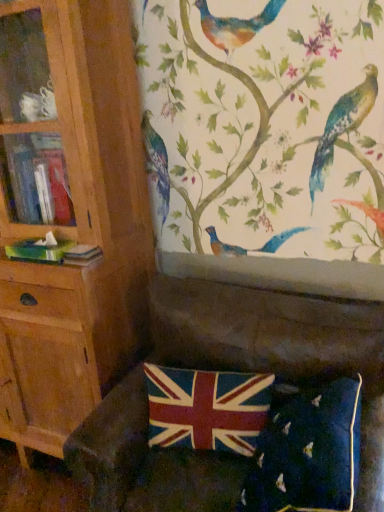
Find the location of a particular element. This screenshot has width=384, height=512. velvet union jack pillow at lower center is located at coordinates (308, 453).

The image size is (384, 512). What do you see at coordinates (278, 346) in the screenshot?
I see `velvet dark green couch at lower center` at bounding box center [278, 346].

Describe the element at coordinates (69, 215) in the screenshot. Image resolution: width=384 pixels, height=512 pixels. I see `wooden bookcase at left` at that location.

You are a GUI agent. You are given a task and a screenshot of the screen. Output one action in this format:
    pyautogui.click(x=<x>, y=<y>)
    Task: Click on the velvet union jack pillow at lower center
    The width and height of the screenshot is (384, 512).
    Given the screenshot: What is the action you would take?
    pyautogui.click(x=308, y=453)

Does point (245, 430) appear closer or farther from the camera than point (314, 298)?

Point (245, 430) is positioned closer to the camera compared to point (314, 298).

From the image's perspective, which is above, velvet union jack at lower center or velvet dark green couch at lower center?

velvet union jack at lower center is shown above in the image.

Consider the image. Is velvet dark green couch at lower center a part of velvet union jack at lower center?

Definitely not — velvet dark green couch at lower center is not inside velvet union jack at lower center.

From a real-world perspective, which object rests below the other?

velvet dark green couch at lower center.

Find the location of `pillow above the velvet dark green couch at lower center (from the image's perspective)`. pillow above the velvet dark green couch at lower center (from the image's perspective) is located at coordinates (308, 453).

Could velvet union jack pillow at lower center be considered to be inside velvet dark green couch at lower center?

Indeed, velvet union jack pillow at lower center is located within velvet dark green couch at lower center.

Does point (352, 356) come in front of point (300, 451)?

No, it is behind (300, 451).

From a real-world perspective, does velvet union jack at lower center sit lower than velvet union jack pillow at lower center?

Incorrect, from a real-world perspective, velvet union jack at lower center is higher than velvet union jack pillow at lower center.

Is point (173, 430) positioned behind point (247, 497)?

That is True.

Is velvet union jack pillow at lower center inside velvet union jack at lower center?

Actually, velvet union jack pillow at lower center is outside velvet union jack at lower center.

Does velvet union jack at lower center have a larger size compared to wooden bookcase at left?

No.

Is point (236, 441) farther from viewer compared to point (0, 170)?

No, it is not.

Relative to wooden bookcase at left, is velvet union jack at lower center in front or behind?

In the image, velvet union jack at lower center appears behind wooden bookcase at left.

Would you consider velvet union jack at lower center to be distant from wooden bookcase at left?

Actually, velvet union jack at lower center and wooden bookcase at left are a little close together.

Is velvet union jack pillow at lower center not close to velvet dark green couch at lower center?

They are positioned close to each other.

Considering the sizes of objects velvet union jack pillow at lower center and velvet dark green couch at lower center in the image provided, who is smaller, velvet union jack pillow at lower center or velvet dark green couch at lower center?

With smaller size is velvet union jack pillow at lower center.

Can you confirm if velvet union jack pillow at lower center is thinner than velvet dark green couch at lower center?

Yes, velvet union jack pillow at lower center is thinner than velvet dark green couch at lower center.

From the image's perspective, between velvet union jack pillow at lower center and velvet dark green couch at lower center, which one is located above?

velvet union jack pillow at lower center is shown above in the image.

From the image's perspective, who appears lower, velvet dark green couch at lower center or wooden bookcase at left?

velvet dark green couch at lower center appears lower in the image.

Choose the correct answer: Is velvet dark green couch at lower center inside wooden bookcase at left or outside it?

velvet dark green couch at lower center lies outside wooden bookcase at left.

Which object is more forward, velvet dark green couch at lower center or wooden bookcase at left?

velvet dark green couch at lower center.

Is point (250, 352) behind point (97, 115)?

No, it is not.

From their relative heights in the image, would you say wooden bookcase at left is taller or shorter than velvet union jack at lower center?

Clearly, wooden bookcase at left is taller compared to velvet union jack at lower center.

In order to click on flag behind the wooden bookcase at left in this screenshot , I will do `click(207, 408)`.

From the image's perspective, which is above, wooden bookcase at left or velvet union jack at lower center?

wooden bookcase at left is shown above in the image.

Measure the distance from wooden bookcase at left to velvet union jack at lower center.

wooden bookcase at left and velvet union jack at lower center are 22.94 inches apart from each other.

The width and height of the screenshot is (384, 512). In order to click on studio couch on the right of velvet union jack at lower center in this screenshot , I will do `click(278, 346)`.

At what (x,y) coordinates should I click in order to perform the action: click on studio couch to the left of velvet union jack pillow at lower center. Please return your answer as a coordinate pair (x, y). This screenshot has width=384, height=512. Looking at the image, I should click on (278, 346).

Which object lies nearer to the anchor point velvet union jack at lower center, wooden bookcase at left or velvet union jack pillow at lower center?

velvet union jack pillow at lower center is positioned closer to the anchor velvet union jack at lower center.

Which object lies nearer to the anchor point wooden bookcase at left, velvet union jack pillow at lower center or velvet union jack at lower center?

velvet union jack at lower center lies closer to wooden bookcase at left than the other object.

Based on their spatial positions, is wooden bookcase at left or velvet dark green couch at lower center closer to velvet union jack pillow at lower center?

Among the two, velvet dark green couch at lower center is located nearer to velvet union jack pillow at lower center.

When comparing their distances from velvet dark green couch at lower center, does wooden bookcase at left or velvet union jack pillow at lower center seem closer?

The object closer to velvet dark green couch at lower center is velvet union jack pillow at lower center.

Based on their spatial positions, is velvet union jack at lower center or wooden bookcase at left closer to velvet union jack pillow at lower center?

Based on the image, velvet union jack at lower center appears to be nearer to velvet union jack pillow at lower center.

When comparing their distances from velvet union jack at lower center, does velvet dark green couch at lower center or wooden bookcase at left seem closer?

Based on the image, velvet dark green couch at lower center appears to be nearer to velvet union jack at lower center.

When comparing their distances from velvet union jack at lower center, does velvet union jack pillow at lower center or velvet dark green couch at lower center seem closer?

velvet dark green couch at lower center lies closer to velvet union jack at lower center than the other object.

Considering their positions, is velvet union jack pillow at lower center positioned closer to velvet union jack at lower center than wooden bookcase at left?

velvet union jack pillow at lower center lies closer to velvet union jack at lower center than the other object.

This screenshot has width=384, height=512. I want to click on studio couch situated between wooden bookcase at left and velvet union jack pillow at lower center from left to right, so click(x=278, y=346).

Identify the location of pillow between velvet dark green couch at lower center and velvet union jack at lower center in the front-back direction. This screenshot has height=512, width=384. (308, 453).

Where is `flag between wooden bookcase at left and velvet dark green couch at lower center from left to right`? The image size is (384, 512). flag between wooden bookcase at left and velvet dark green couch at lower center from left to right is located at coordinates (207, 408).

In order to click on flag situated between wooden bookcase at left and velvet union jack pillow at lower center from left to right in this screenshot , I will do `click(207, 408)`.